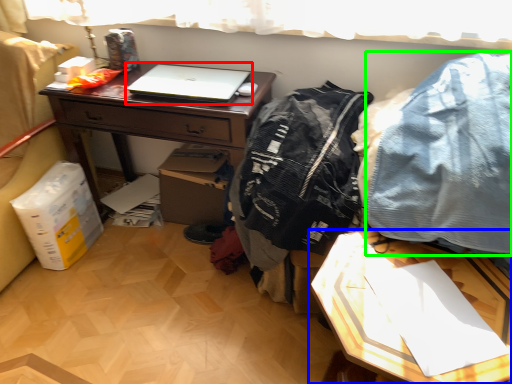
Question: Considering the real-world distances, which object is farthest from laptop (highlighted by a red box)? table (highlighted by a blue box) or clothing (highlighted by a green box)?

Choices:
 (A) table
 (B) clothing

Answer: (A)